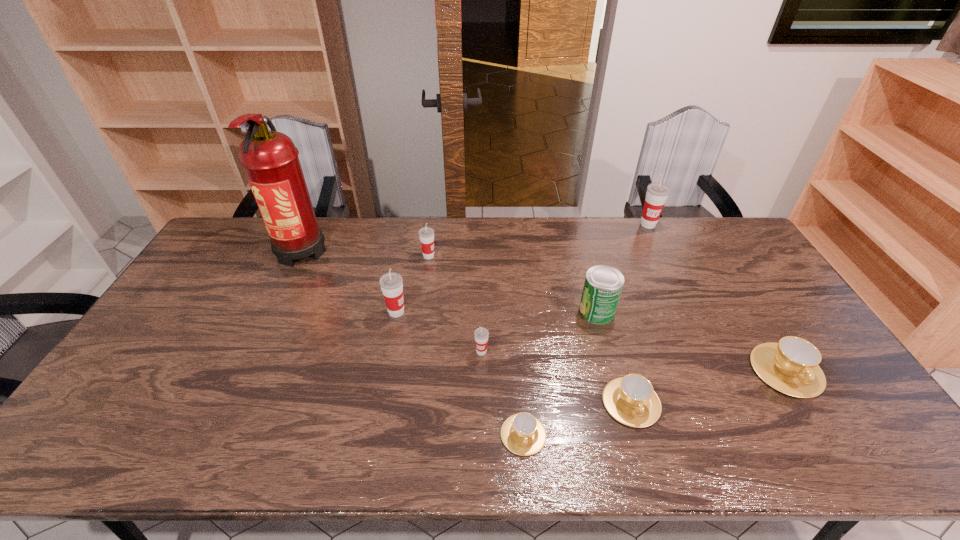
Find the location of a particular element. object that is the third closest to the rightmost cup is located at coordinates (657, 193).

Identify which cup is located as the second nearest to the second shortest object. Please provide its 2D coordinates. Your answer should be formatted as a tuple, i.e. [(x, y)], where the tuple contains the x and y coordinates of a point satisfying the conditions above.

[(791, 366)]

Locate which cup is the third closest to the fourth object from left to right. Please provide its 2D coordinates. Your answer should be formatted as a tuple, i.e. [(x, y)], where the tuple contains the x and y coordinates of a point satisfying the conditions above.

[(631, 400)]

Locate an element on the screen. the second closest red cup relative to the fire extinguisher is located at coordinates (426, 234).

Select which red cup appears as the third closest to the second red cup from left to right. Please provide its 2D coordinates. Your answer should be formatted as a tuple, i.e. [(x, y)], where the tuple contains the x and y coordinates of a point satisfying the conditions above.

[(657, 193)]

The height and width of the screenshot is (540, 960). I want to click on the closest brown cup relative to the red fire extinguisher, so click(523, 434).

Select which brown cup appears as the closest to the third cup from right to left. Please provide its 2D coordinates. Your answer should be formatted as a tuple, i.e. [(x, y)], where the tuple contains the x and y coordinates of a point satisfying the conditions above.

[(523, 434)]